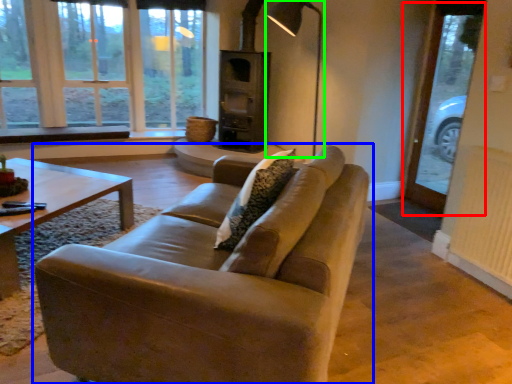
Question: Which is farther away from screen door (highlighted by a red box)? studio couch (highlighted by a blue box) or lamp (highlighted by a green box)?

Choices:
 (A) studio couch
 (B) lamp

Answer: (A)